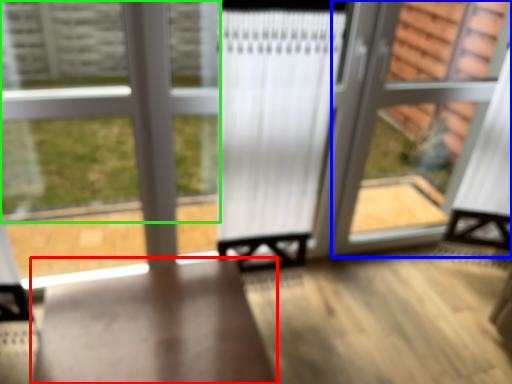
Question: Which is nearer to the furniture (highlighted by a red box)? screen door (highlighted by a blue box) or bay window (highlighted by a green box).

Choices:
 (A) screen door
 (B) bay window

Answer: (B)